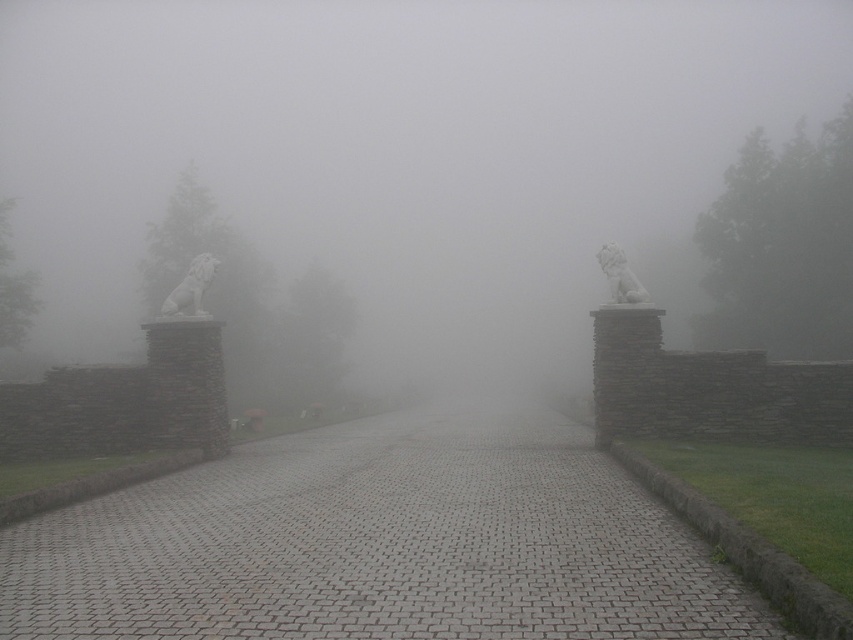
Between point (550, 12) and point (167, 305), which one is positioned in front?

Point (167, 305)

This screenshot has height=640, width=853. Describe the element at coordinates (398, 154) in the screenshot. I see `white stone lions at center` at that location.

Is point (206, 45) in front of point (202, 257)?

No, it is not.

Find the location of a particular element. This screenshot has height=640, width=853. white stone lions at center is located at coordinates (398, 154).

Can you confirm if white stone lions at center is positioned to the right of gray cobblestone path at center?

Yes, white stone lions at center is to the right of gray cobblestone path at center.

From the picture: Who is taller, white stone lions at center or gray cobblestone path at center?

Standing taller between the two is white stone lions at center.

Describe the element at coordinates (398, 154) in the screenshot. I see `white stone lions at center` at that location.

Identify the location of white stone lions at center. This screenshot has height=640, width=853. (398, 154).

Measure the distance between white stone lion at left and white marble lion at right.

They are 11.09 meters apart.

Is point (184, 310) more distant than point (630, 291)?

Yes, point (184, 310) is farther from viewer.

At what (x,y) coordinates should I click in order to perform the action: click on white stone lion at left. Please return your answer as a coordinate pair (x, y). Looking at the image, I should click on (190, 288).